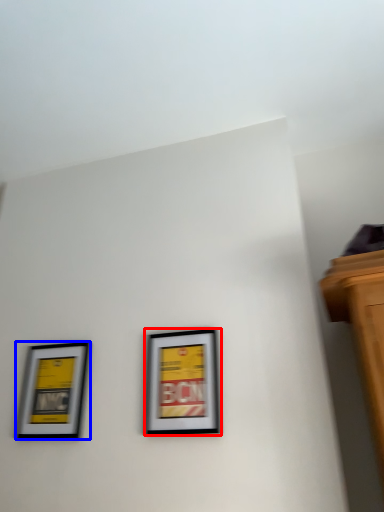
Question: Which object appears closest to the camera in this image, picture frame (highlighted by a red box) or picture frame (highlighted by a blue box)?

Choices:
 (A) picture frame
 (B) picture frame

Answer: (A)